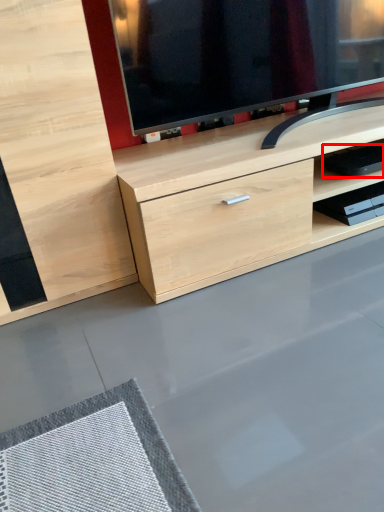
Question: Observing the image, what is the correct spatial positioning of equipment (annotated by the red box) in reference to shelf?

Choices:
 (A) left
 (B) right

Answer: (A)